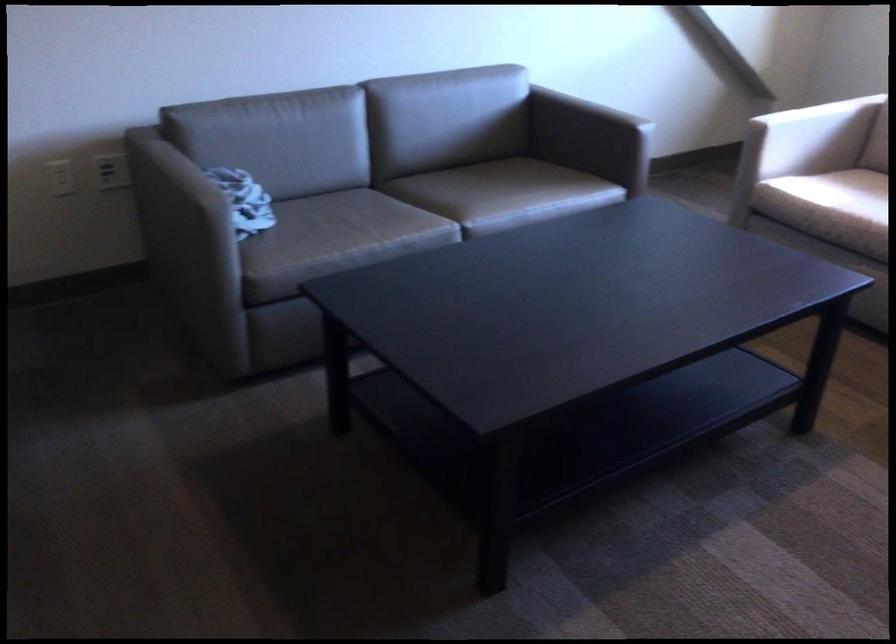
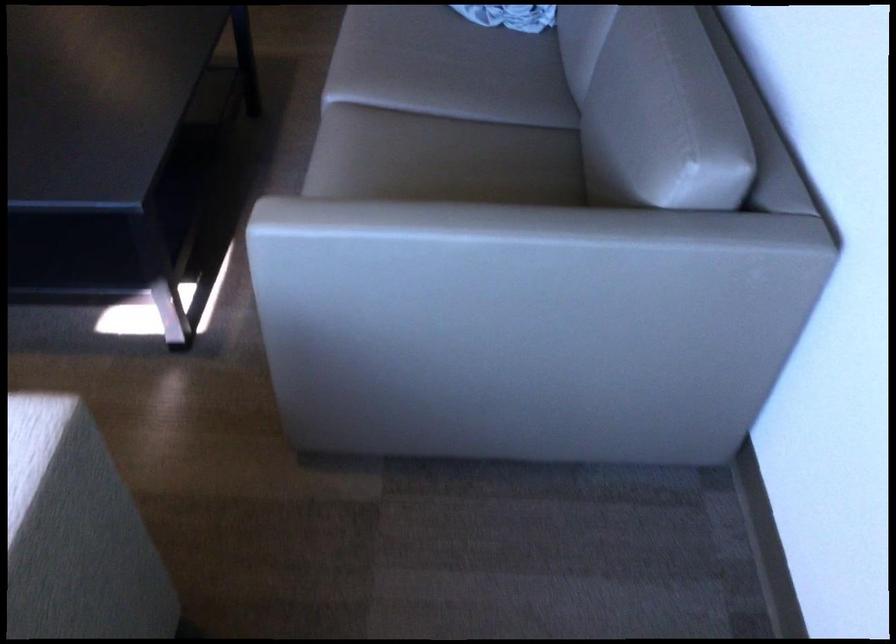
The point at (578, 102) is marked in the first image. Where is the corresponding point in the second image?

(485, 249)